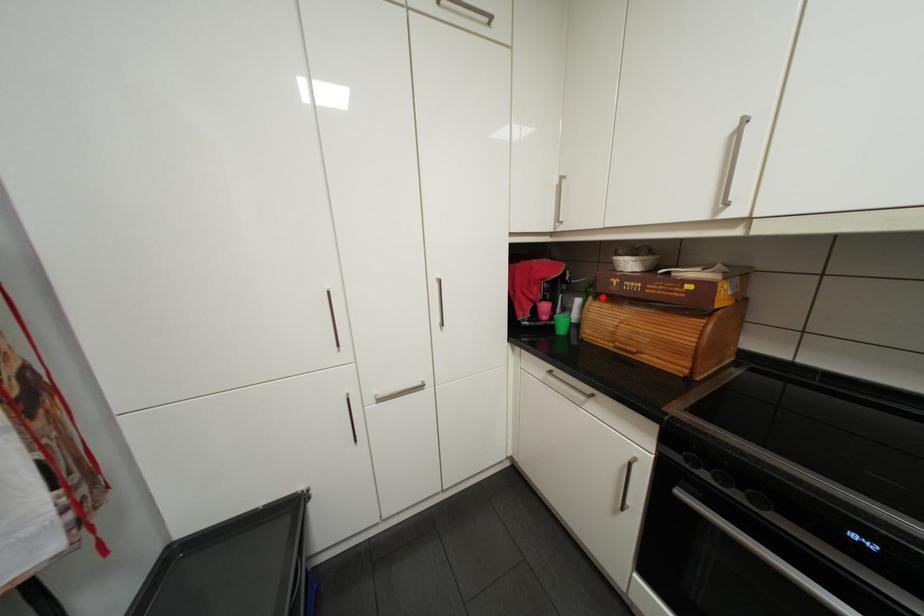
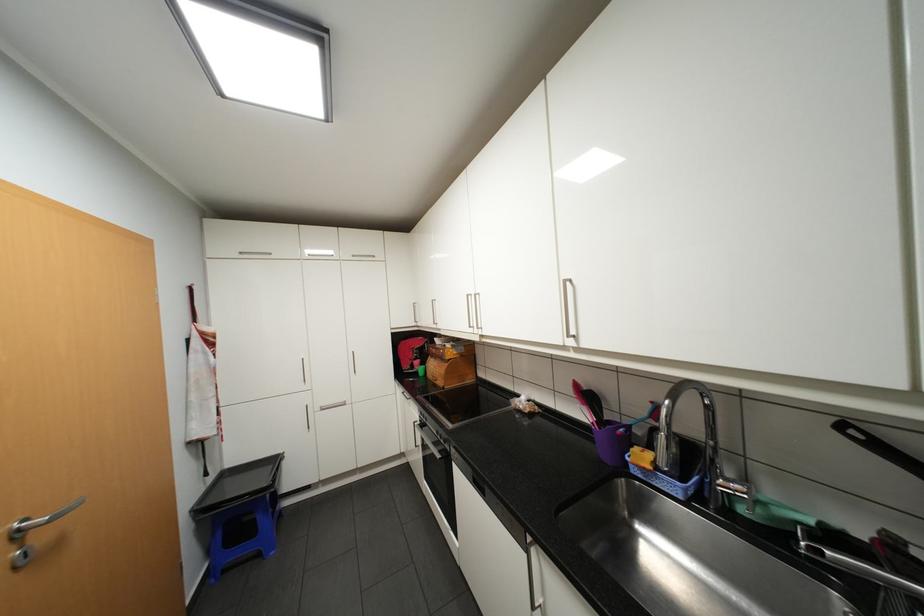
Locate, in the second image, the point that corresponds to the highlighted location in the first image.

(440, 355)